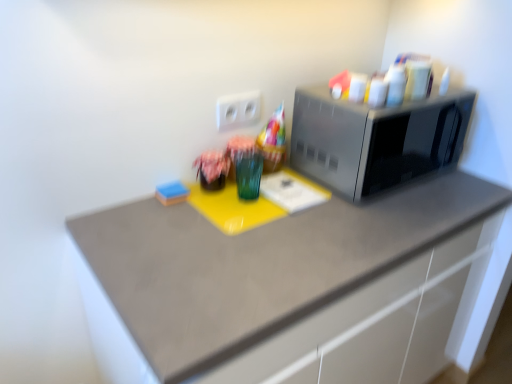
The width and height of the screenshot is (512, 384). I want to click on vacant space in front of satin silver microwave at right, so click(x=374, y=225).